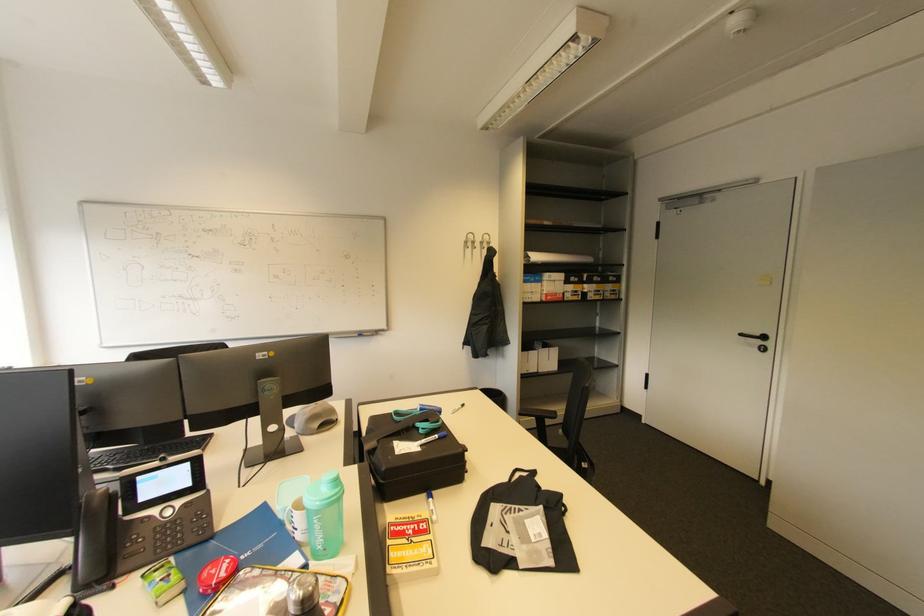
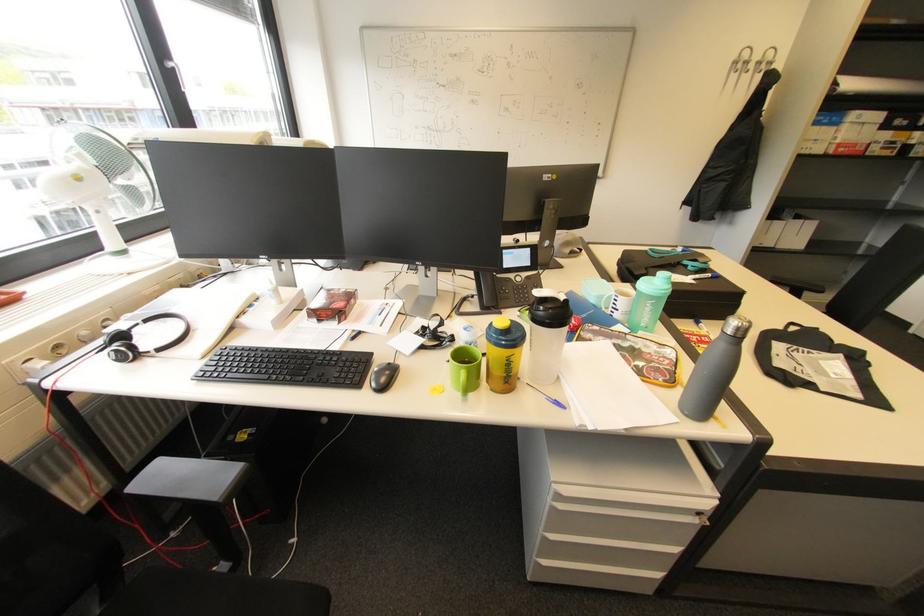
In the second image, find the point that corresponds to (x=309, y=562) in the first image.

(635, 331)